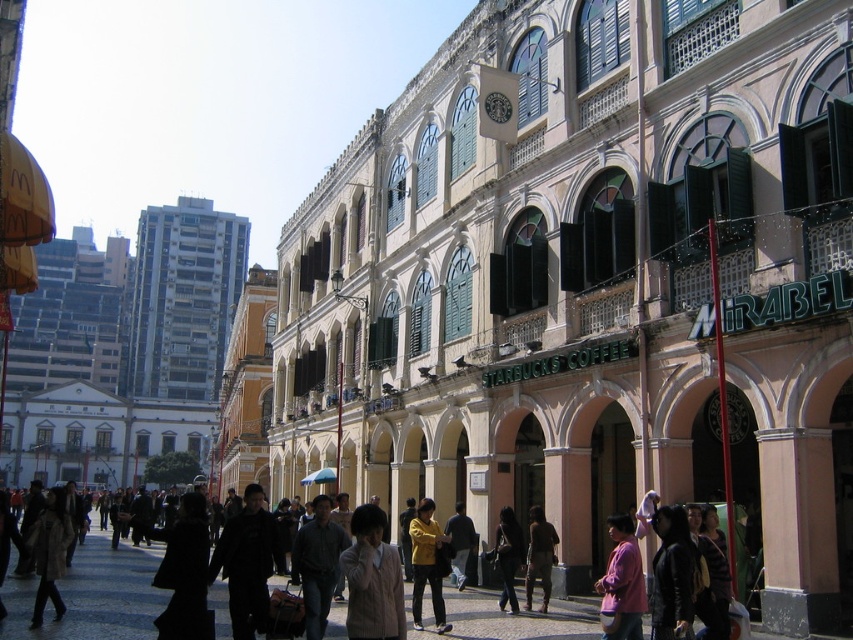
You are a fashion designer observing a group of people on the bustling urban street. You notice a light beige sweater at center and a dark gray fabric jacket at center. How far apart are these two clothing items from each other?

The light beige sweater at center and dark gray fabric jacket at center are 13.52 meters apart from each other.

You are a tailor observing a customer trying on two garments. The customer is wearing a light beige sweater at center and a dark gray fabric jacket at center. Which garment has a wider width?

The light beige sweater at center has a wider width than the dark gray fabric jacket at center according to the description.

What is the exact location of the pink matte shirt at lower right in the image?

The pink matte shirt at lower right is located at point coordinates 0.911 on the x axis and 0.730 on the y axis.